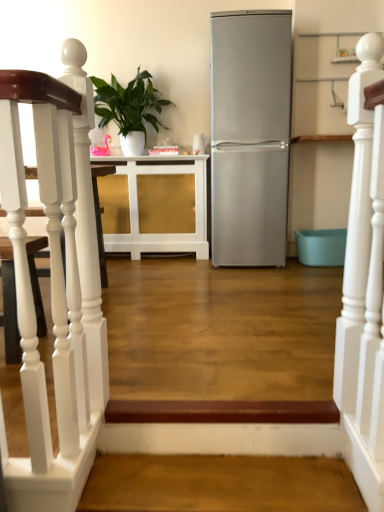
At what (x,y) coordinates should I click in order to perform the action: click on free point above brown wood stairwell at lower center, the first stairwell positioned from the bottom (from a real-world perspective). Please return your answer as a coordinate pair (x, y). Looking at the image, I should click on (219, 481).